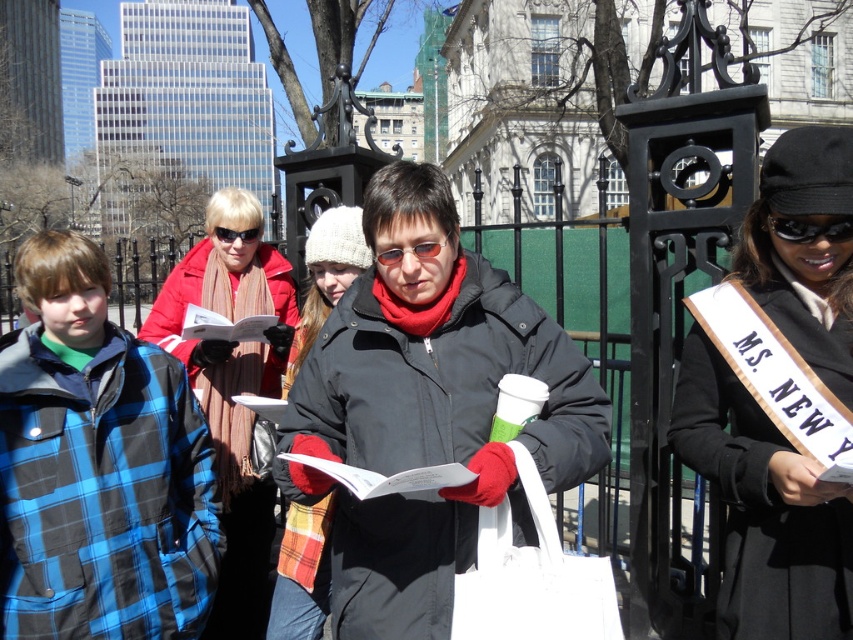
Question: Which point is farther to the camera?

Choices:
 (A) black fabric sash at center
 (B) sunglasses at center

Answer: (B)

Question: Can you confirm if black fabric sash at center is thinner than sunglasses at center?

Choices:
 (A) yes
 (B) no

Answer: (A)

Question: Does black plastic goggles at upper right have a greater width compared to matte black goggles at upper center?

Choices:
 (A) yes
 (B) no

Answer: (B)

Question: Considering the relative positions of black fabric sash at center and black plastic goggles at upper right in the image provided, where is black fabric sash at center located with respect to black plastic goggles at upper right?

Choices:
 (A) below
 (B) above

Answer: (B)

Question: Which point is closer to the camera?

Choices:
 (A) (422, 257)
 (B) (831, 240)

Answer: (B)

Question: Which object is farther from the camera taking this photo?

Choices:
 (A) black fabric sash at center
 (B) white matte bag at center
 (C) blue plaid jacket at left
 (D) red scarf at center

Answer: (D)